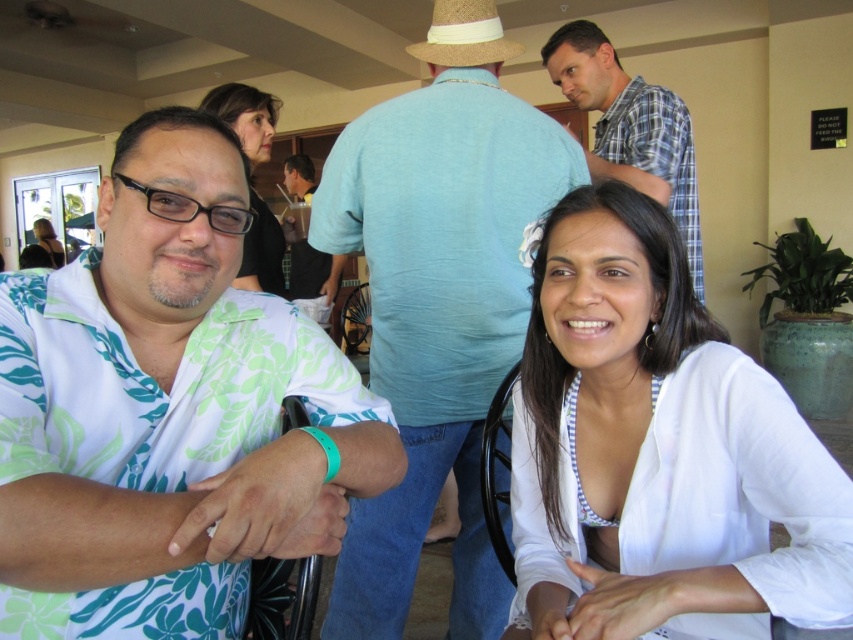
You are standing in the room and want to take a photo of the matte black hair at upper center. If your camera has a focal length of 50mm and you want to capture the entire object in the frame, what is the minimum distance you should maintain from the object to ensure it fits within the camera sensor?

The distance of matte black hair at upper center from viewer is 35.37 inches, so you should maintain at least 35.37 inches to ensure the entire object fits within the camera sensor.

You are organizing a clothing display and need to arrange the white floral shirt at left and the plaid cotton shirt at upper center side by side. Based on their widths, which shirt should be placed on the left to ensure they fit within the display area?

The white floral shirt at left should be placed on the left since it has a lesser width compared to the plaid cotton shirt at upper center, allowing both shirts to fit better within the display area.